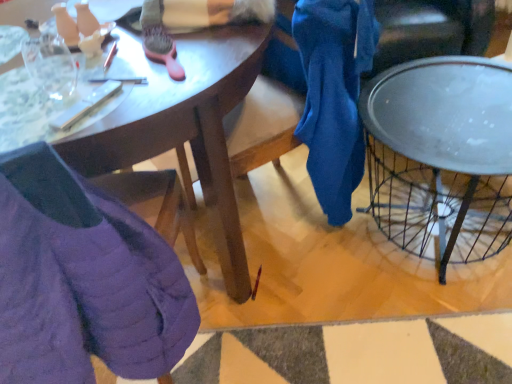
Question: Is matte wooden desk at center inside or outside of metallic silver tray at right?

Choices:
 (A) outside
 (B) inside

Answer: (A)

Question: Is point (114, 165) closer or farther from the camera than point (501, 144)?

Choices:
 (A) closer
 (B) farther

Answer: (A)

Question: Which object is the closest to the metallic silver tray at right?

Choices:
 (A) purple quilted jacket at lower left
 (B) matte wooden desk at center

Answer: (B)

Question: Estimate the real-world distances between objects in this image. Which object is closer to the matte wooden desk at center?

Choices:
 (A) metallic silver tray at right
 (B) purple quilted jacket at lower left

Answer: (B)